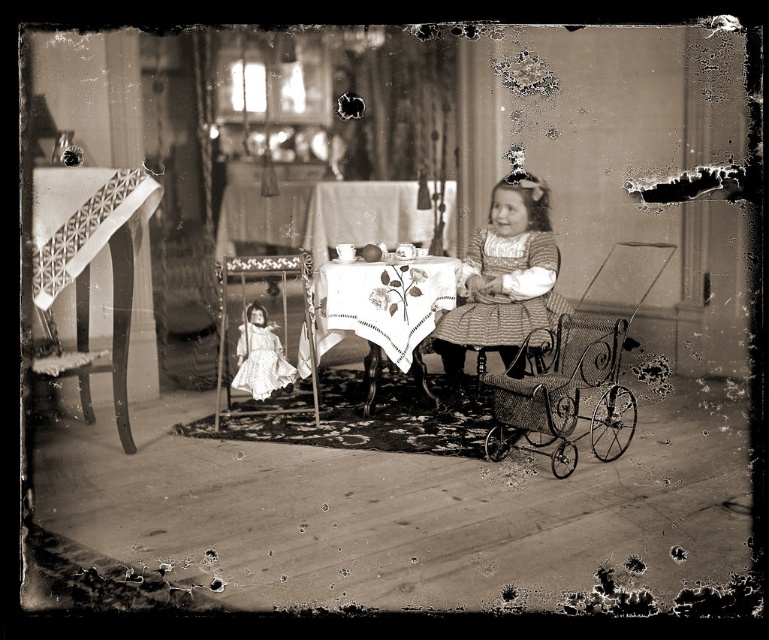
Is striped fabric dress at center above white satin doll at center?

Yes, striped fabric dress at center is above white satin doll at center.

Who is taller, striped fabric dress at center or white satin doll at center?

With more height is striped fabric dress at center.

In order to click on striped fabric dress at center in this screenshot , I will do `click(504, 280)`.

Which is in front, point (514, 346) or point (381, 316)?

Point (381, 316)

Which is above, striped fabric dress at center or embroidered fabric tablecloth at center?

Positioned higher is striped fabric dress at center.

Measure the distance between point (541, 241) and camera.

Point (541, 241) and camera are 4.59 meters apart from each other.

Identify the location of striped fabric dress at center. (504, 280).

Who is higher up, white woven fabric at left or white satin doll at center?

white woven fabric at left is higher up.

Looking at this image, between white woven fabric at left and white satin doll at center, which one is positioned lower?

white satin doll at center

At what (x,y) coordinates should I click in order to perform the action: click on white woven fabric at left. Please return your answer as a coordinate pair (x, y). Looking at the image, I should click on (92, 262).